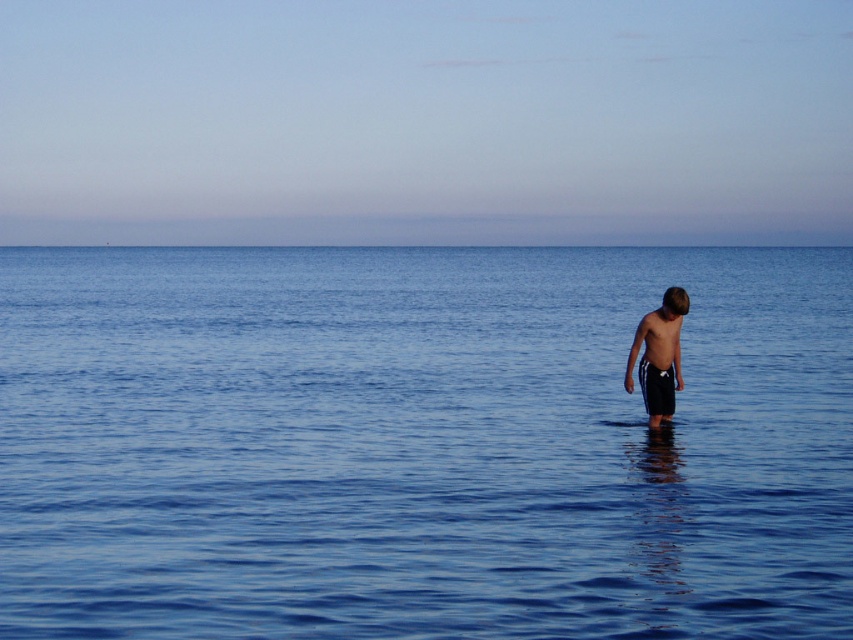
Who is positioned more to the right, blue smooth water at upper center or dark blue shorts at center?

From the viewer's perspective, dark blue shorts at center appears more on the right side.

Does blue smooth water at upper center come in front of dark blue shorts at center?

No, blue smooth water at upper center is further to the viewer.

Does point (578, 232) come in front of point (659, 340)?

No, it is behind (659, 340).

The height and width of the screenshot is (640, 853). What are the coordinates of `blue smooth water at upper center` in the screenshot? It's located at (436, 230).

Does blue smooth water at center have a greater width compared to blue smooth water at upper center?

In fact, blue smooth water at center might be narrower than blue smooth water at upper center.

Who is shorter, blue smooth water at center or blue smooth water at upper center?

blue smooth water at upper center

Is point (222, 438) closer to camera compared to point (697, 224)?

Yes, it is in front of point (697, 224).

Identify the location of blue smooth water at center. (421, 444).

Who is more forward, (715, 609) or (677, 355)?

Positioned in front is point (715, 609).

Does blue smooth water at center have a greater height compared to dark blue shorts at center?

Yes, blue smooth water at center is taller than dark blue shorts at center.

Does point (666, 612) come farther from viewer compared to point (671, 321)?

No, it is in front of (671, 321).

The width and height of the screenshot is (853, 640). Identify the location of blue smooth water at center. (421, 444).